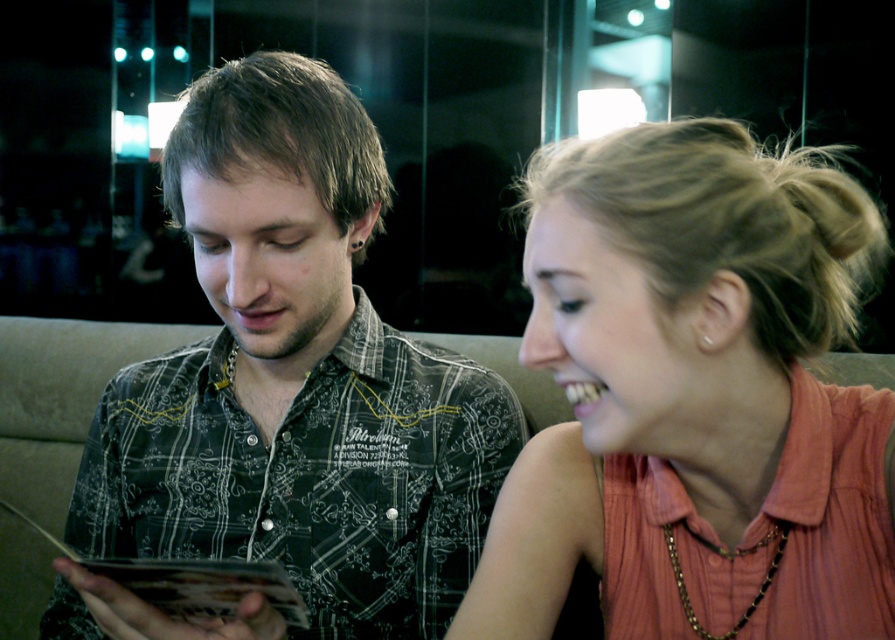
Question: Which point is farther to the camera?

Choices:
 (A) matte coral blouse at center
 (B) black printed shirt at center

Answer: (B)

Question: Does matte coral blouse at center appear on the right side of black printed shirt at center?

Choices:
 (A) yes
 (B) no

Answer: (A)

Question: Is matte coral blouse at center below black printed shirt at center?

Choices:
 (A) no
 (B) yes

Answer: (A)

Question: Is matte coral blouse at center below black printed shirt at center?

Choices:
 (A) yes
 (B) no

Answer: (B)